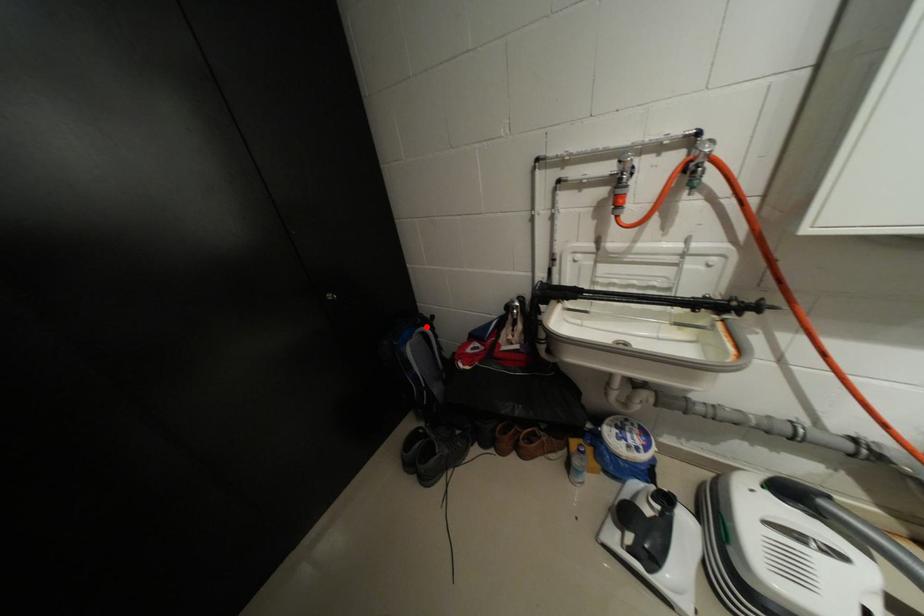
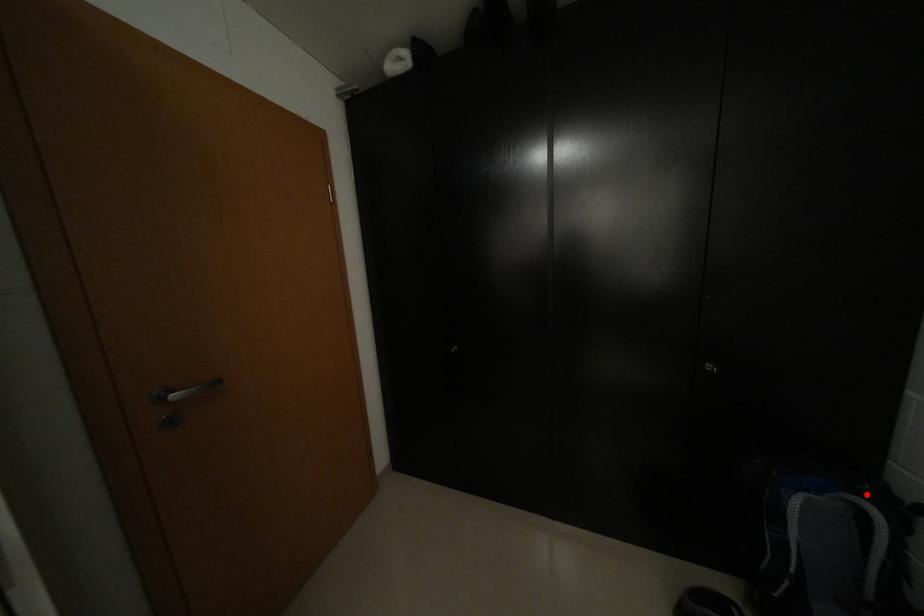
I am providing you with two images of the same scene from different viewpoints. A red point is marked on the first image and another point is marked on the second image. Is the marked point in image1 the same physical position as the marked point in image2?

Yes